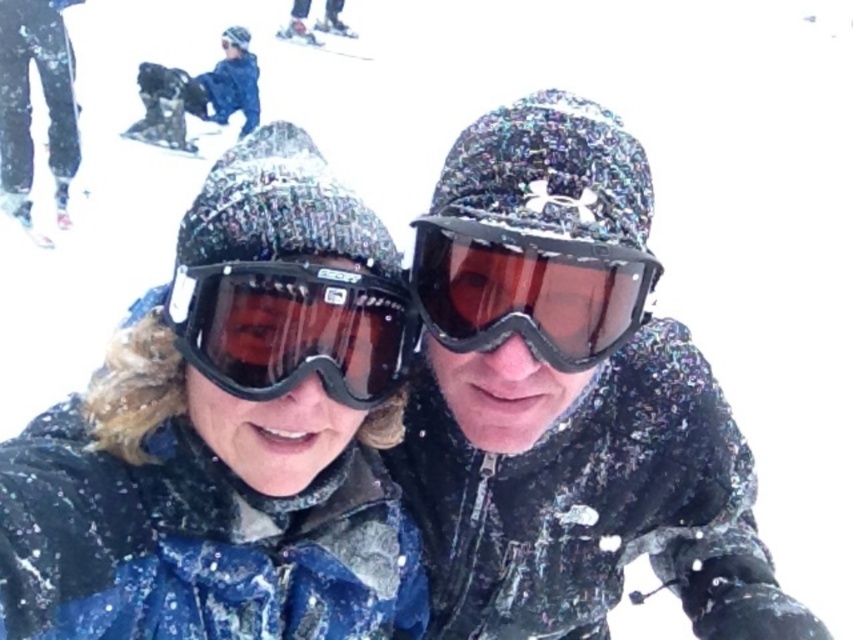
Is transparent plastic goggles at center closer to the viewer compared to matte black ski at left?

That is True.

How far apart are transparent plastic goggles at center and matte black ski at left?

transparent plastic goggles at center is 27.63 feet away from matte black ski at left.

In order to click on transparent plastic goggles at center in this screenshot , I will do `click(293, 328)`.

Is matte blue jacket at center behind matte black goggles at center?

No, matte blue jacket at center is closer to the viewer.

The height and width of the screenshot is (640, 853). What do you see at coordinates (230, 433) in the screenshot? I see `matte blue jacket at center` at bounding box center [230, 433].

The height and width of the screenshot is (640, 853). I want to click on matte blue jacket at center, so click(x=230, y=433).

Is matte blue jacket at center taller than transparent plastic goggles at center?

Yes.

Is matte blue jacket at center below transparent plastic goggles at center?

Indeed, matte blue jacket at center is positioned under transparent plastic goggles at center.

Is point (267, 486) positioned behind point (383, 291)?

Yes.

At what (x,y) coordinates should I click in order to perform the action: click on matte blue jacket at center. Please return your answer as a coordinate pair (x, y). Image resolution: width=853 pixels, height=640 pixels. Looking at the image, I should click on (230, 433).